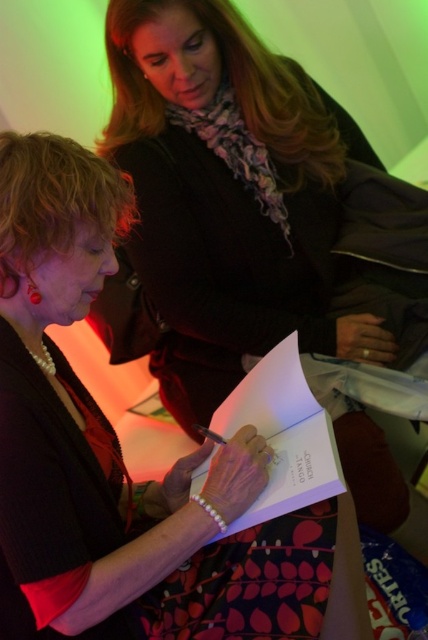
Question: Which object is farther from the camera taking this photo?

Choices:
 (A) matte black book at center
 (B) white paper book at center

Answer: (B)

Question: Does matte black book at center lie in front of white paper book at center?

Choices:
 (A) yes
 (B) no

Answer: (A)

Question: Does matte black book at center have a greater width compared to white paper book at center?

Choices:
 (A) yes
 (B) no

Answer: (A)

Question: Can you confirm if matte black book at center is positioned to the left of white paper book at center?

Choices:
 (A) no
 (B) yes

Answer: (B)

Question: Which point is closer to the camera taking this photo?

Choices:
 (A) (318, 476)
 (B) (306, 573)

Answer: (B)

Question: Which point is farther to the camera?

Choices:
 (A) (339, 532)
 (B) (232, 428)

Answer: (B)